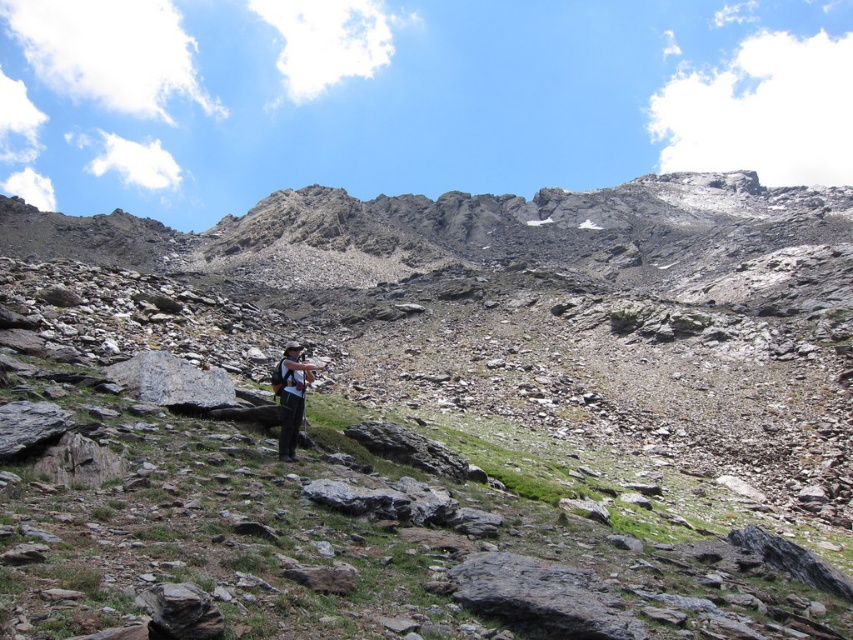
From the picture: You are standing at the base of the gray rocky mountain at center and want to take a photo with your camera. The camera can focus on subjects up to 75 feet away. Will the camera be able to focus on the mountain?

The gray rocky mountain at center and camera are 74.79 feet apart from each other, which is within the camera focus range of up to 75 feet. Therefore, the camera can focus on the mountain.

You are a hiker trying to reach the summit of the gray rocky mountain at center. You notice your matte black backpack at center is in your path. Which direction should you move to avoid it?

The gray rocky mountain at center is positioned on the right side of the matte black backpack at center. To avoid the backpack, you should move to the left side of the matte black backpack at center, away from the gray rocky mountain at center.